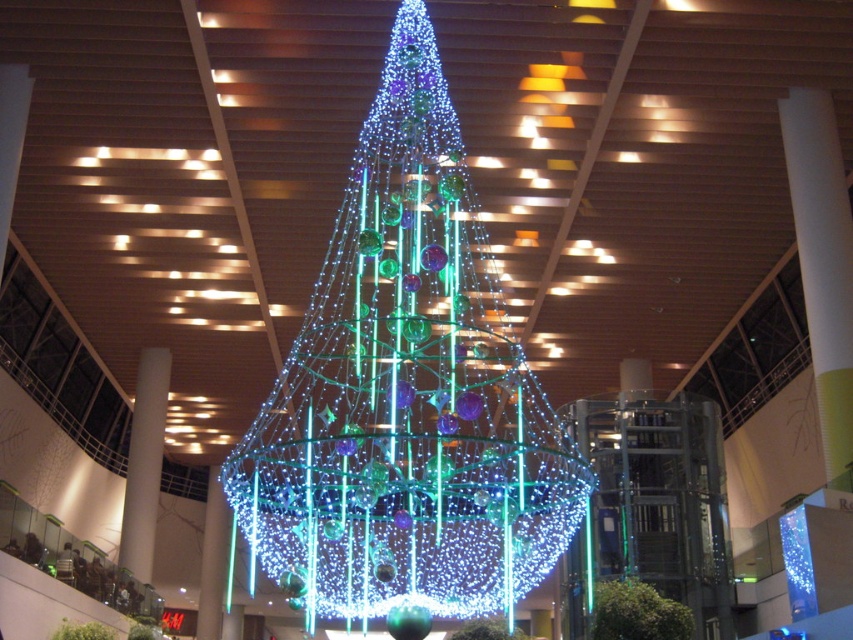
In the scene shown: You are standing in front of the Christmas tree and want to place a decoration on the right side of the tree. Based on the arrangement of the illuminated glass christmas tree at center and the iridescent glass ornaments at center, where should you place the new decoration?

The illuminated glass christmas tree at center is to the left of the iridescent glass ornaments at center, so to place the decoration on the right side of the tree, you should position it near the iridescent glass ornaments at center.

From the picture: You are a maintenance worker in the mall and need to reach the iridescent glass ornaments at center from the illuminated glass christmas tree at center. Can you safely use a 10 meter ladder to bridge the gap between them?

The distance between the illuminated glass christmas tree at center and the iridescent glass ornaments at center is 9.94 meters. A 10 meter ladder would be sufficient to bridge the gap safely since it is slightly longer than the required distance.

You are standing in a shopping mall and see the illuminated glass christmas tree at center. If you want to take a photo of it from directly above, where should you position yourself relative to the tree?

To take a photo of the illuminated glass christmas tree at center from directly above, you should position yourself directly above the tree at point (x=405, y=396).